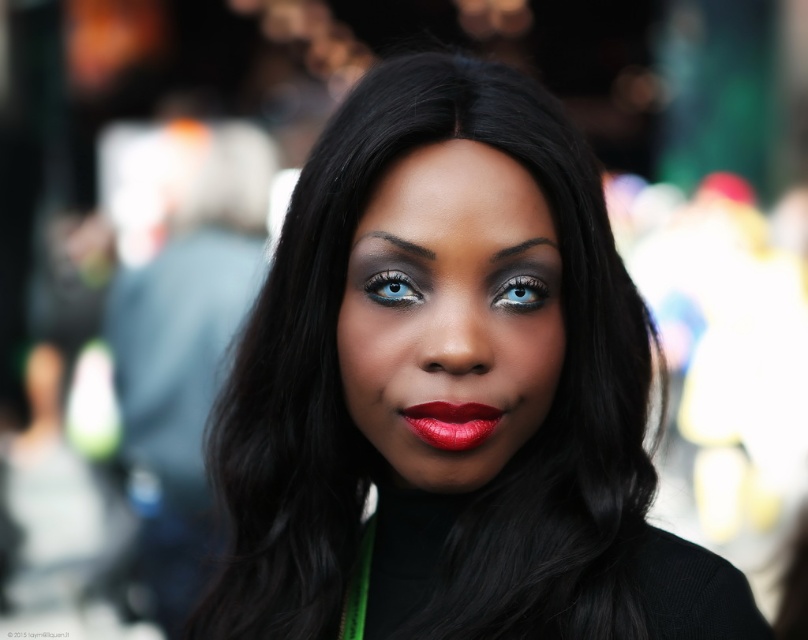
You are a photographer adjusting the focus on your camera. You want to ensure both the matte black hair at center and the matte black face at center are in focus. Given that the depth of field can cover 2 inches, will both objects stay sharp?

The matte black hair at center and matte black face at center are 2.05 inches apart. Since the depth of field can cover 2 inches, the distance between them slightly exceeds the coverage. Therefore, both objects might not stay entirely sharp.

You are a makeup artist analyzing the subject in the image. You notice two blue eyes with different finishes. The blue matte eye at upper center and the blue glossy eye at upper center. Which eye has a taller shape?

The blue matte eye at upper center is much taller than the blue glossy eye at upper center.

You are a photographer adjusting your camera settings to capture the subject in the image. You notice the matte black face at center and the shiny matte lipstick at center. Which object is positioned to the right side?

The matte black face at center is positioned to the right of the shiny matte lipstick at center.